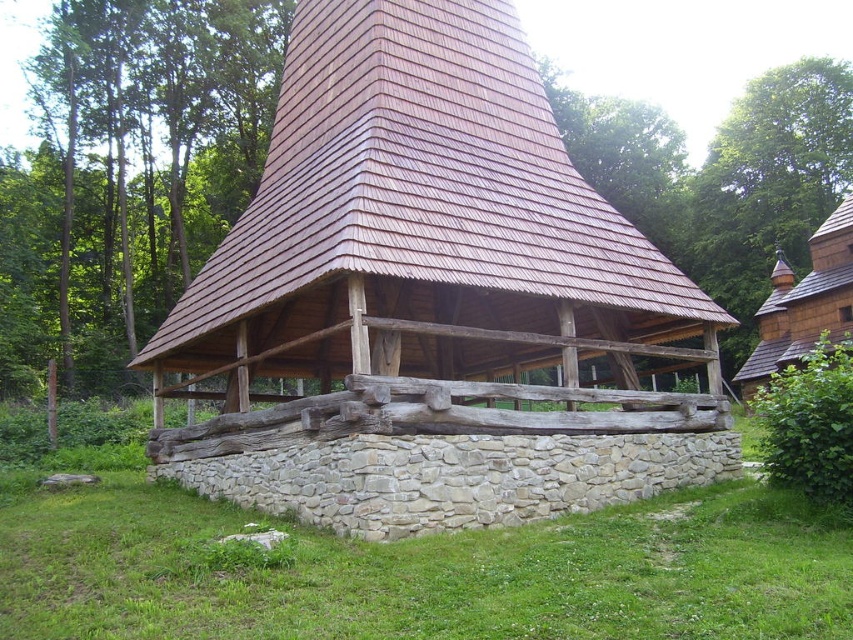
You are standing in front of the rustic wooden structure and want to determine which of the two points, point (648, 513) or point (785, 280), is closer to you. Based on the structure, can you identify which point is nearer?

Point (648, 513) is closer to the viewer than point (785, 280).

You are standing at a point and want to take a photo of the rustic wooden structure. The structure is located at point (529, 561). If you are 36.33 feet away from this point, will the entire structure fit in your camera frame? Assume your camera has a standard 50mm lens with a 46 degree angle of view.

The distance between you and the point (529, 561) is 36.33 feet. With a 50mm lens and 46 degree angle of view, the horizontal field of view at that distance is approximately 28.3 feet. Since the rustic wooden structure is likely smaller than 28.3 feet in width, it should fit within the camera frame.